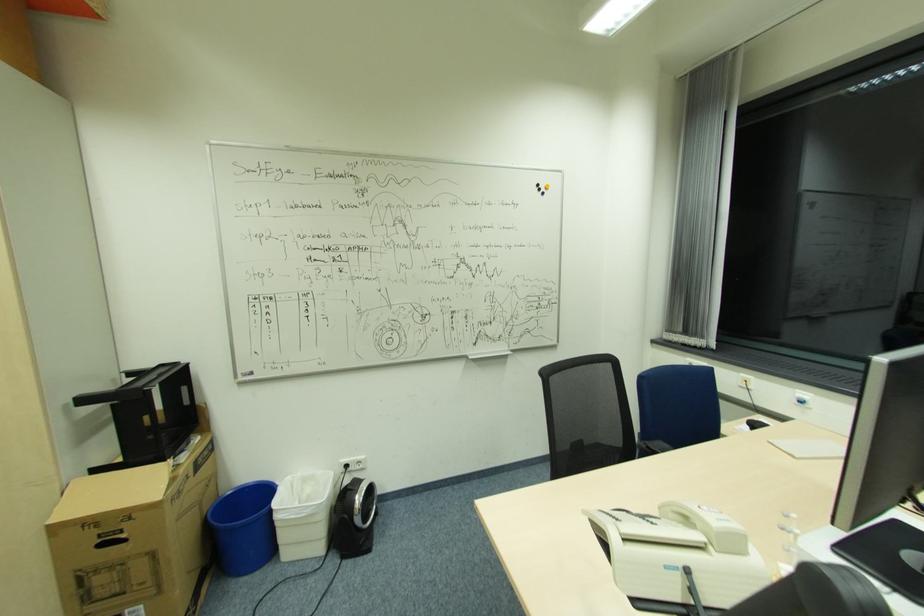
Where would you lift the white telephone handset? Please return your answer as a coordinate pair (x, y).

(708, 525)